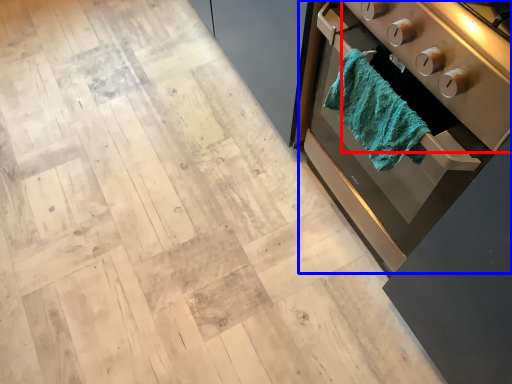
Question: Among these objects, which one is farthest to the camera, appliance (highlighted by a red box) or home appliance (highlighted by a blue box)?

Choices:
 (A) appliance
 (B) home appliance

Answer: (B)